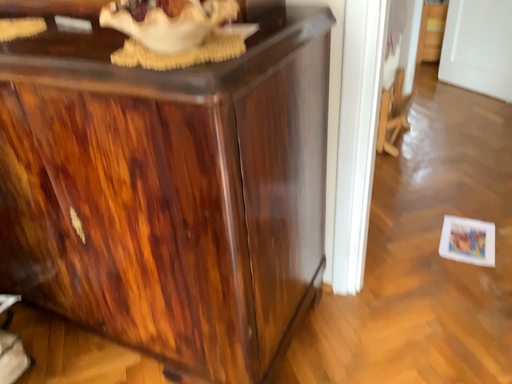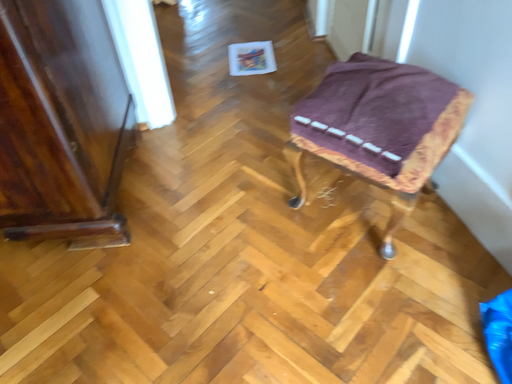
Question: Which way did the camera rotate in the video?

Choices:
 (A) rotated upward
 (B) rotated downward

Answer: (B)